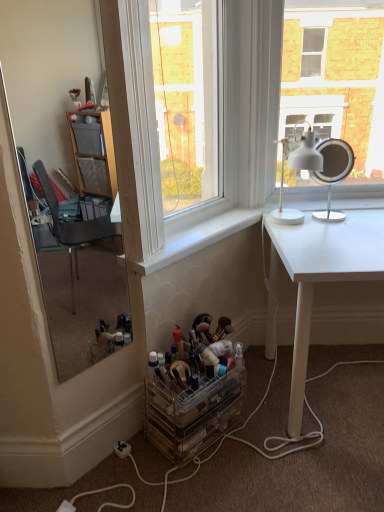
Locate an element on the screen. Image resolution: width=384 pixels, height=512 pixels. free space underneath white matte desk at right (from a real-world perspective) is located at coordinates (340, 387).